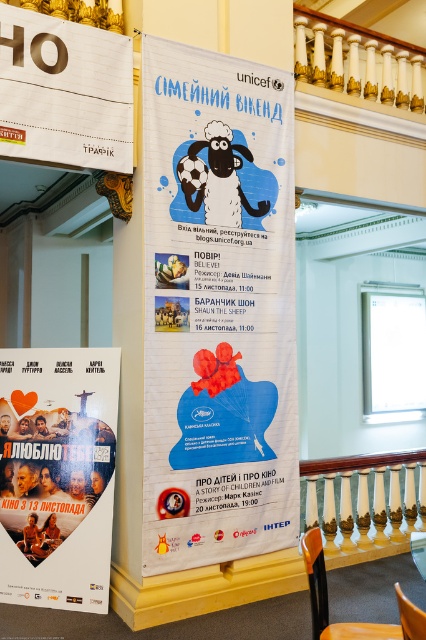
Can you confirm if blue paper poster at center is shorter than matte paper poster at lower left?

Incorrect, blue paper poster at center's height does not fall short of matte paper poster at lower left's.

Between blue paper poster at center and matte paper poster at lower left, which one is positioned lower?

matte paper poster at lower left

In order to click on blue paper poster at center in this screenshot , I will do [216, 308].

How much distance is there between blue paper poster at center and brown wooden chair at lower right?

blue paper poster at center is 2.47 meters away from brown wooden chair at lower right.

The height and width of the screenshot is (640, 426). What do you see at coordinates (216, 308) in the screenshot?
I see `blue paper poster at center` at bounding box center [216, 308].

Where is `blue paper poster at center`? This screenshot has height=640, width=426. blue paper poster at center is located at coordinates [x=216, y=308].

Does point (287, 200) lie in front of point (319, 621)?

No, (287, 200) is further to viewer.

Is point (293, 385) positioned before point (333, 634)?

No.

This screenshot has height=640, width=426. What are the coordinates of `blue paper poster at center` in the screenshot? It's located at (216, 308).